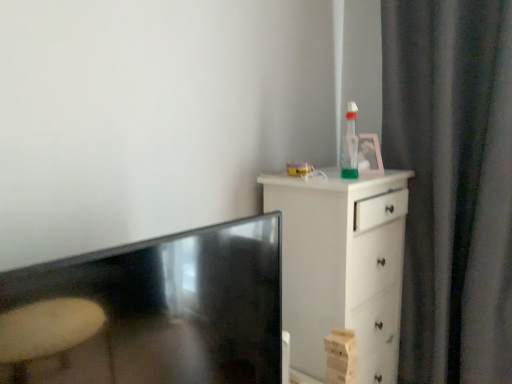
Question: Is point (291, 354) positioned closer to the camera than point (449, 173)?

Choices:
 (A) farther
 (B) closer

Answer: (B)

Question: Considering the positions of white wood chest of drawers at right and dark gray fabric curtain at right in the image, is white wood chest of drawers at right taller or shorter than dark gray fabric curtain at right?

Choices:
 (A) short
 (B) tall

Answer: (A)

Question: Which object is the farthest from the white wood chest of drawers at right?

Choices:
 (A) matte black tv at lower left
 (B) translucent green bottle at upper right
 (C) dark gray fabric curtain at right

Answer: (A)

Question: Which of these objects is positioned farthest from the dark gray fabric curtain at right?

Choices:
 (A) white wood chest of drawers at right
 (B) matte black tv at lower left
 (C) translucent green bottle at upper right

Answer: (B)